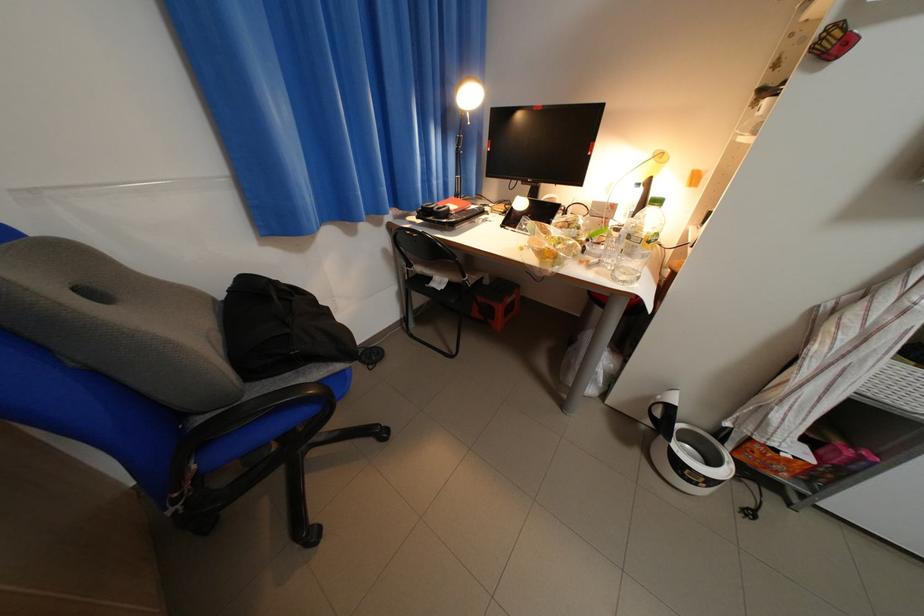
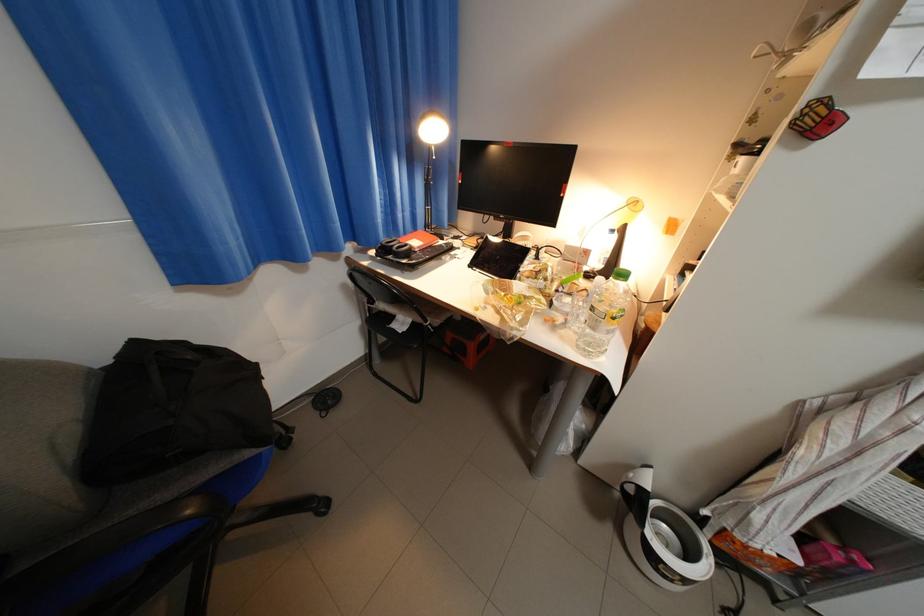
The point at (396, 252) is marked in the first image. Where is the corresponding point in the second image?

(355, 286)